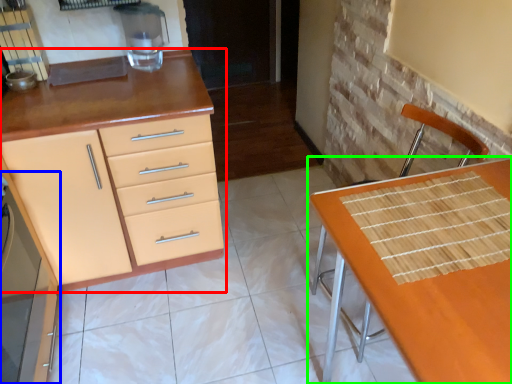
Question: Estimate the real-world distances between objects in this image. Which object is closer to cabinetry (highlighted by a red box), cabinetry (highlighted by a blue box) or table (highlighted by a green box)?

Choices:
 (A) cabinetry
 (B) table

Answer: (A)